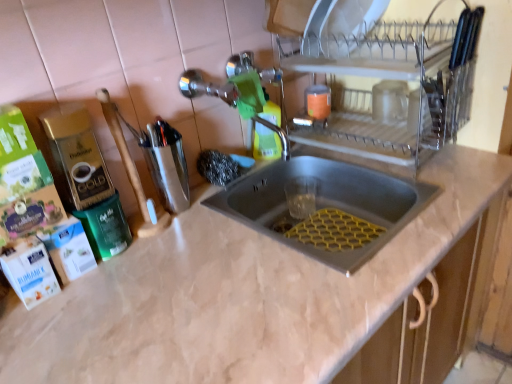
Question: Is stainless steel sink at center to the right of clear glass dish rack at upper right, the first appliance viewed from the right, from the viewer's perspective?

Choices:
 (A) yes
 (B) no

Answer: (B)

Question: Is stainless steel sink at center further to the viewer compared to clear glass dish rack at upper right, which is the 2th appliance from left to right?

Choices:
 (A) no
 (B) yes

Answer: (A)

Question: Is stainless steel sink at center looking in the opposite direction of clear glass dish rack at upper right, which is the 2th appliance from left to right?

Choices:
 (A) no
 (B) yes

Answer: (A)

Question: Is stainless steel sink at center taller than clear glass dish rack at upper right, which is the 2th appliance from left to right?

Choices:
 (A) yes
 (B) no

Answer: (B)

Question: Is stainless steel sink at center closer to camera compared to clear glass dish rack at upper right, which is the 2th appliance from left to right?

Choices:
 (A) no
 (B) yes

Answer: (B)

Question: Is stainless steel sink at center in contact with clear glass dish rack at upper right, the first appliance viewed from the right?

Choices:
 (A) yes
 (B) no

Answer: (B)

Question: Is green matte bottle at center behind metallic silver utensil holder at center-left, acting as the second appliance starting from the right?

Choices:
 (A) yes
 (B) no

Answer: (A)

Question: Considering the relative sizes of green matte bottle at center and metallic silver utensil holder at center-left, acting as the second appliance starting from the right, in the image provided, is green matte bottle at center taller than metallic silver utensil holder at center-left, acting as the second appliance starting from the right,?

Choices:
 (A) no
 (B) yes

Answer: (A)

Question: Considering the relative sizes of green matte bottle at center and metallic silver utensil holder at center-left, acting as the second appliance starting from the right, in the image provided, is green matte bottle at center smaller than metallic silver utensil holder at center-left, acting as the second appliance starting from the right,?

Choices:
 (A) yes
 (B) no

Answer: (A)

Question: Is green matte bottle at center shorter than metallic silver utensil holder at center-left, placed as the first appliance when sorted from left to right?

Choices:
 (A) no
 (B) yes

Answer: (B)

Question: From the image's perspective, does green matte bottle at center appear lower than metallic silver utensil holder at center-left, acting as the second appliance starting from the right?

Choices:
 (A) yes
 (B) no

Answer: (B)

Question: Could you tell me if green matte bottle at center is turned towards metallic silver utensil holder at center-left, acting as the second appliance starting from the right?

Choices:
 (A) no
 (B) yes

Answer: (A)

Question: Can metallic silver utensil holder at center-left, acting as the second appliance starting from the right, be found inside stainless steel sink at center?

Choices:
 (A) yes
 (B) no

Answer: (B)